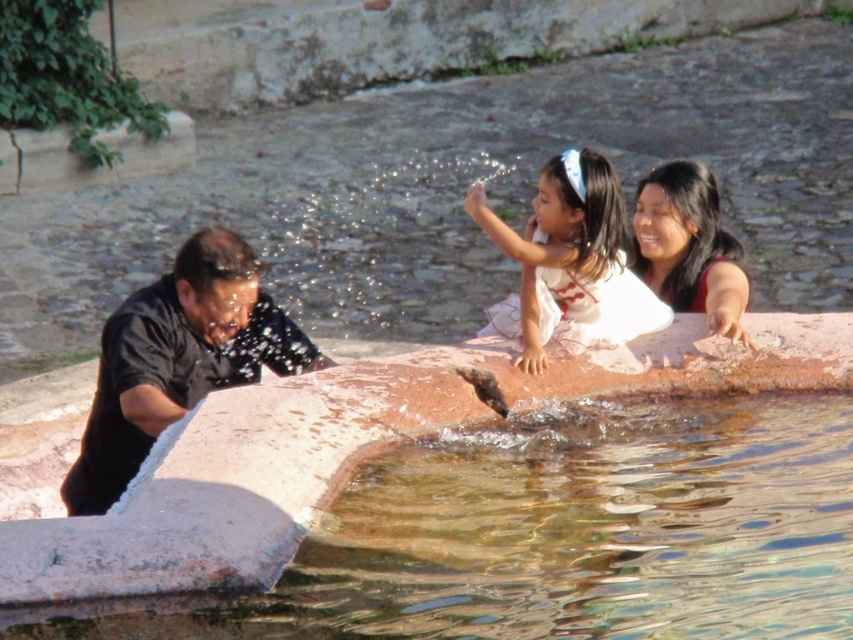
Question: Which is farther from the clear water at fountain left?

Choices:
 (A) white satin dress at center
 (B) smooth red dress at upper right

Answer: (B)

Question: Is clear water at fountain left to the left of black matte shirt at left from the viewer's perspective?

Choices:
 (A) no
 (B) yes

Answer: (A)

Question: Is black matte shirt at left wider than smooth red dress at upper right?

Choices:
 (A) yes
 (B) no

Answer: (B)

Question: Which point is closer to the camera?

Choices:
 (A) clear water at fountain left
 (B) white satin dress at center

Answer: (A)

Question: Among these objects, which one is farthest from the camera?

Choices:
 (A) clear water at fountain left
 (B) smooth red dress at upper right
 (C) black matte shirt at left
 (D) white satin dress at center

Answer: (C)

Question: Where is clear water at fountain left located in relation to smooth red dress at upper right in the image?

Choices:
 (A) right
 (B) left

Answer: (B)